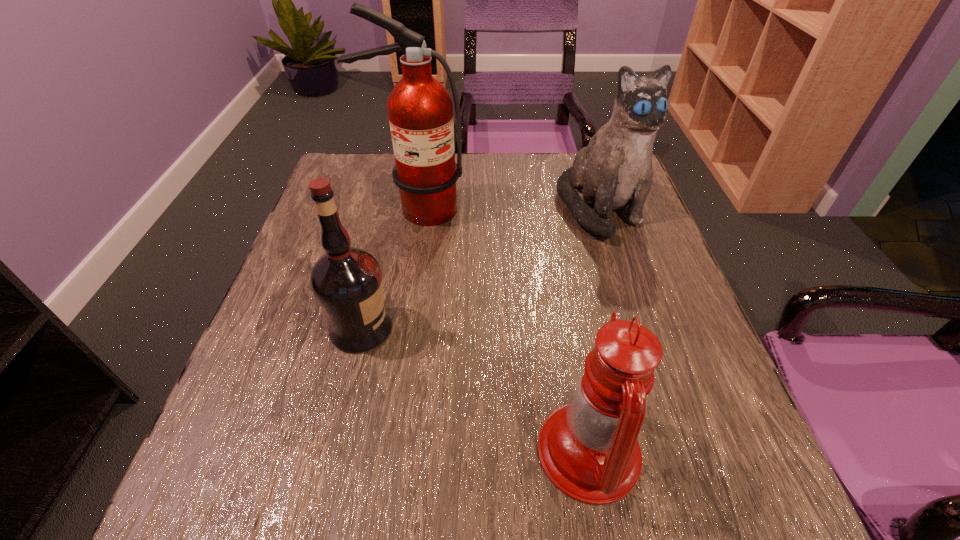
This screenshot has width=960, height=540. Find the location of `free space at the far left corner`. free space at the far left corner is located at coordinates (343, 181).

Where is `free space between the cat and the liquor`? Image resolution: width=960 pixels, height=540 pixels. free space between the cat and the liquor is located at coordinates (480, 268).

Where is `free spot between the fire extinguisher and the oil lamp`? The width and height of the screenshot is (960, 540). free spot between the fire extinguisher and the oil lamp is located at coordinates (503, 330).

This screenshot has height=540, width=960. I want to click on free space between the third farthest object and the cat, so click(x=480, y=268).

Identify the location of free spot between the liquor and the oil lamp. [475, 390].

At what (x,y) coordinates should I click in order to perform the action: click on free space between the cat and the fire extinguisher. Please return your answer as a coordinate pair (x, y). The height and width of the screenshot is (540, 960). Looking at the image, I should click on (509, 209).

I want to click on empty space that is in between the tallest object and the liquor, so click(x=390, y=269).

Find the location of `vacant space that is in between the cat and the fire extinguisher`. vacant space that is in between the cat and the fire extinguisher is located at coordinates click(x=509, y=209).

At what (x,y) coordinates should I click in order to perform the action: click on free point between the nearest object and the fire extinguisher. Please return your answer as a coordinate pair (x, y). Image resolution: width=960 pixels, height=540 pixels. Looking at the image, I should click on (503, 330).

The height and width of the screenshot is (540, 960). I want to click on vacant space that's between the oil lamp and the cat, so click(x=594, y=330).